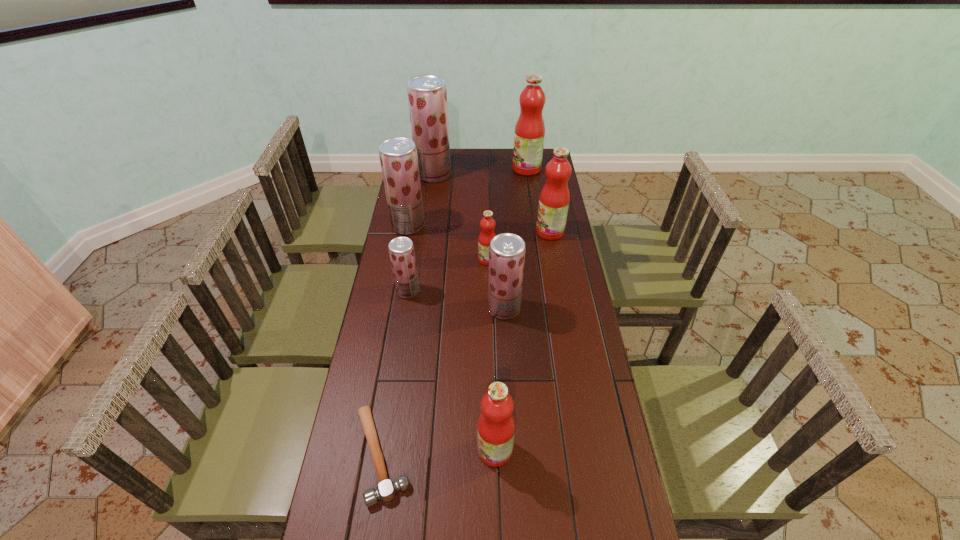
This screenshot has width=960, height=540. I want to click on object present at the far right corner, so click(529, 134).

In the image, there is a desktop. In order to click on vacant space at the far edge in this screenshot , I will do `click(505, 157)`.

Find the location of `free location at the left edge of the desktop`. free location at the left edge of the desktop is located at coordinates point(372,514).

What are the coordinates of `free space at the right edge of the desktop` in the screenshot? It's located at (573, 297).

The height and width of the screenshot is (540, 960). Identify the location of free region at the far right corner of the desktop. (549, 156).

In order to click on vacant area between the second smallest strawberry fruit juice and the biggest strawberry fruit juice in this screenshot , I will do `click(468, 241)`.

Identify the location of vacant space that's between the smallest pink fruit juice and the second biggest strawberry fruit juice. (447, 242).

You are a GUI agent. You are given a task and a screenshot of the screen. Output one action in this format:
    pyautogui.click(x=<x>, y=<y>)
    Task: Click on the free space between the nearest pink fruit juice and the third smallest strawberry fruit juice
    This screenshot has width=960, height=540.
    Given the screenshot: What is the action you would take?
    pyautogui.click(x=451, y=338)

Find the location of a particular element. free space between the farthest pink fruit juice and the smallest strawberry fruit juice is located at coordinates (468, 230).

At what (x,y) coordinates should I click in order to perform the action: click on free space between the second farthest strawberry fruit juice and the smallest pink fruit juice. Please return your answer as a coordinate pair (x, y). The height and width of the screenshot is (540, 960). Looking at the image, I should click on (447, 242).